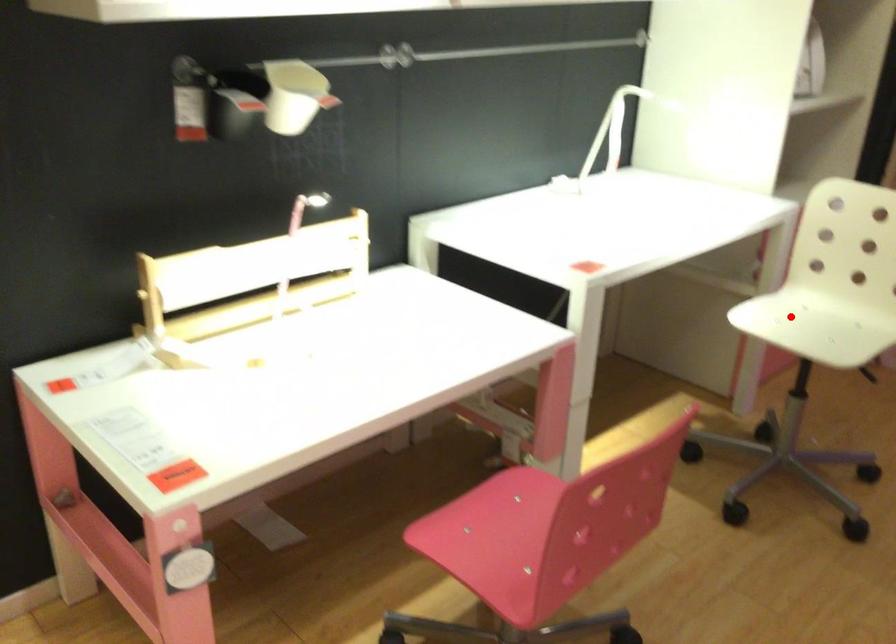
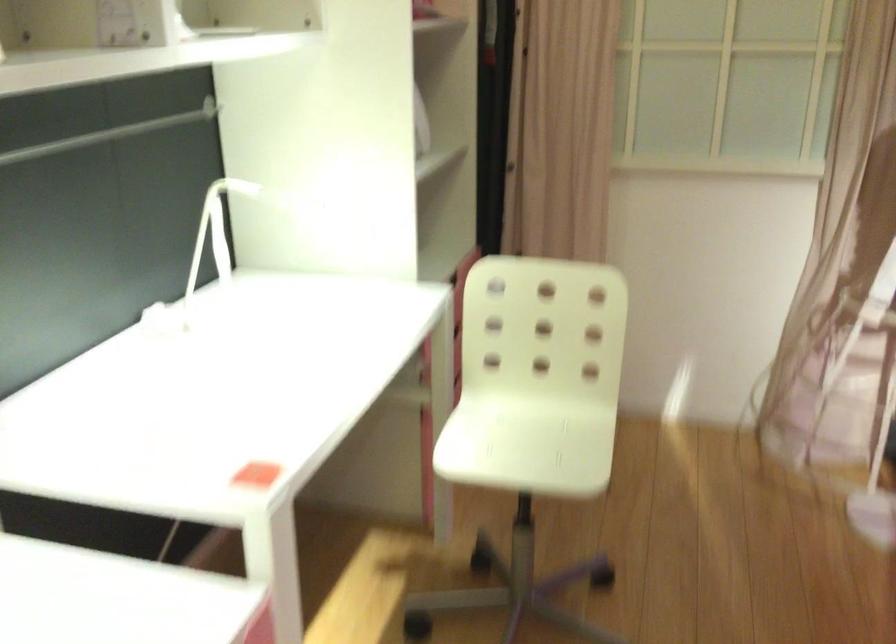
Question: A red point is marked in image1. In image2, is the corresponding 3D point closer to the camera or farther? Reply with the corresponding letter.

Choices:
 (A) The corresponding 3D point is closer.
 (B) The corresponding 3D point is farther.

Answer: (A)